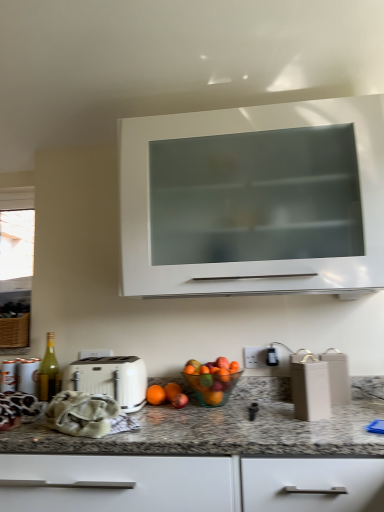
What is the approximate height of granite at lower center?

23.23 inches.

In order to face red matte apple at center, should I rotate leftwards or rightwards?

Turn left approximately 1.471 degrees to face it.

This screenshot has height=512, width=384. Describe the element at coordinates (254, 199) in the screenshot. I see `white glossy cabinet at upper center` at that location.

Locate an element on the screen. green glass bottle at left is located at coordinates (48, 372).

How far apart are red matte apple at center and green glass bottle at left?

A distance of 20.65 inches exists between red matte apple at center and green glass bottle at left.

Does red matte apple at center turn towards green glass bottle at left?

No.

Is red matte apple at center to the left or to the right of green glass bottle at left in the image?

In the image, red matte apple at center appears on the right side of green glass bottle at left.

Is the surface of red matte apple at center in direct contact with green glass bottle at left?

red matte apple at center and green glass bottle at left are clearly separated.

From the picture: From a real-world perspective, is orange matte at center on top of translucent glass bowl at center?

No, from a real-world perspective, orange matte at center is not over translucent glass bowl at center

In terms of height, does orange matte at center look taller or shorter compared to translucent glass bowl at center?

Clearly, orange matte at center is shorter compared to translucent glass bowl at center.

Is orange matte at center not close to translucent glass bowl at center?

orange matte at center is actually quite close to translucent glass bowl at center.

Looking at the image, does orange matte at center seem bigger or smaller compared to translucent glass bowl at center?

Considering their sizes, orange matte at center takes up less space than translucent glass bowl at center.

Which object is closer to the camera, granite at lower center or orange matte at center?

granite at lower center is closer to the camera.

From the image's perspective, is granite at lower center on top of orange matte at center?

Incorrect, from the image's perspective, granite at lower center is lower than orange matte at center.

Is granite at lower center far from orange matte at center?

No, granite at lower center is not far from orange matte at center.

Is white glossy cabinet at upper center aimed at red matte apple at center?

No, white glossy cabinet at upper center is not aimed at red matte apple at center.

Does white glossy cabinet at upper center lie in front of red matte apple at center?

Yes, it is in front of red matte apple at center.

Is white glossy cabinet at upper center spatially inside red matte apple at center, or outside of it?

white glossy cabinet at upper center cannot be found inside red matte apple at center.

In the image, is white matte toaster at center positioned in front of or behind granite at lower center?

white matte toaster at center is positioned farther from the viewer than granite at lower center.

Is white matte toaster at center spatially inside granite at lower center, or outside of it?

white matte toaster at center lies within the bounds of granite at lower center.

Considering the positions of objects white matte toaster at center and granite at lower center in the image provided, who is more to the left, white matte toaster at center or granite at lower center?

white matte toaster at center is more to the left.

Can you confirm if white matte toaster at center is wider than granite at lower center?

No, white matte toaster at center is not wider than granite at lower center.

Would you say green glass bottle at left contains transparent glass window at left?

Actually, transparent glass window at left is outside green glass bottle at left.

Can you confirm if green glass bottle at left is shorter than transparent glass window at left?

Yes.

Based on the photo, from a real-world perspective, who is located higher, green glass bottle at left or transparent glass window at left?

From a 3D spatial view, transparent glass window at left is above.

Is green glass bottle at left wider or thinner than transparent glass window at left?

Considering their sizes, green glass bottle at left looks slimmer than transparent glass window at left.

Is point (320, 413) positioned before point (298, 122)?

That is True.

Is matte beige container at lower right wider or thinner than white glossy cabinet at upper center?

Clearly, matte beige container at lower right has less width compared to white glossy cabinet at upper center.

The image size is (384, 512). I want to click on cabinetry positioned vertically above the matte beige container at lower right (from a real-world perspective), so click(254, 199).

You are a GUI agent. You are given a task and a screenshot of the screen. Output one action in this format:
    pyautogui.click(x=<x>, y=<y>)
    Task: Click on the apple below the green glass bottle at left (from a real-world perspective)
    
    Given the screenshot: What is the action you would take?
    pyautogui.click(x=179, y=400)

Where is `bowl that is on the right side of orange matte at center`? The height and width of the screenshot is (512, 384). bowl that is on the right side of orange matte at center is located at coordinates (212, 387).

When comparing their distances from translucent glass bowl at center, does transparent glass window at left or green glass bottle at left seem further?

The object further to translucent glass bowl at center is transparent glass window at left.

From the image, which object appears to be farther from granite at lower center, matte beige container at lower right or translucent glass bowl at center?

The object further to granite at lower center is translucent glass bowl at center.

From the image, which object appears to be farther from green glass bottle at left, translucent glass bowl at center or red matte apple at center?

Among the two, translucent glass bowl at center is located further to green glass bottle at left.

In the scene shown: Which object lies further to the anchor point green glass bottle at left, matte beige container at lower right or red matte apple at center?

The object further to green glass bottle at left is matte beige container at lower right.

Which object lies nearer to the anchor point granite at lower center, white matte toaster at center or green glass bottle at left?

The object closer to granite at lower center is white matte toaster at center.

Looking at the image, which one is located closer to white glossy cabinet at upper center, red matte apple at center or green glass bottle at left?

Based on the image, red matte apple at center appears to be nearer to white glossy cabinet at upper center.

Which object lies nearer to the anchor point granite at lower center, matte beige container at lower right or white glossy cabinet at upper center?

matte beige container at lower right lies closer to granite at lower center than the other object.

Looking at the image, which one is located further to translucent glass bowl at center, white matte toaster at center or green glass bottle at left?

green glass bottle at left.

Locate an element on the screen. The height and width of the screenshot is (512, 384). bottle between transparent glass window at left and white glossy cabinet at upper center from left to right is located at coordinates (48, 372).

At what (x,y) coordinates should I click in order to perform the action: click on cabinetry between transparent glass window at left and matte beige container at lower right from left to right. Please return your answer as a coordinate pair (x, y). Looking at the image, I should click on (254, 199).

This screenshot has height=512, width=384. Identify the location of apple situated between white matte toaster at center and translucent glass bowl at center from left to right. (179, 400).

I want to click on toaster positioned between granite at lower center and translucent glass bowl at center from near to far, so click(110, 379).